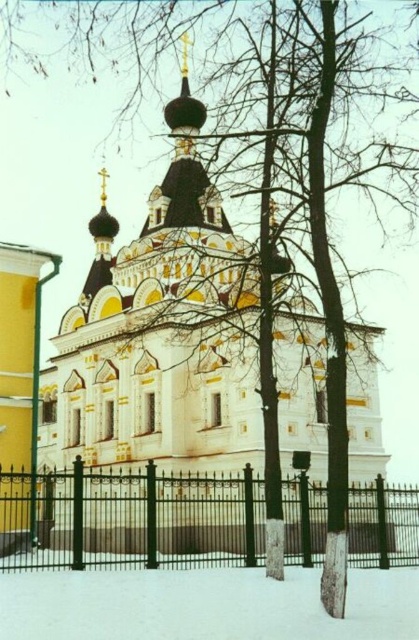
You are a visitor at the church and want to walk from the black metal fence at lower left to the white powdery snow at lower center. Is the snow accessible from the fence?

The white powdery snow at lower center is behind the black metal fence at lower left, so it is not accessible from the fence unless you can go through or over the fence.

You are standing at the entrance of the traditional Russian Orthodox church and want to take a photo of the church without any obstructions. The black metal fence at lower left is in your way. Is the fence located at a specific coordinate that you should avoid?

The black metal fence at lower left is located at point (129, 518), so you should avoid that coordinate to take an unobstructed photo of the church.

From the picture: You are standing at the base of the traditional Russian Orthodox church and want to place a 50 meter long decorative banner between the black metal fence at lower left and the nearest point of the church. Will the banner be long enough to stretch between them?

The distance between the black metal fence at lower left and the nearest point of the church is 54.49 meters, so the 50 meter banner is not long enough to stretch between them.